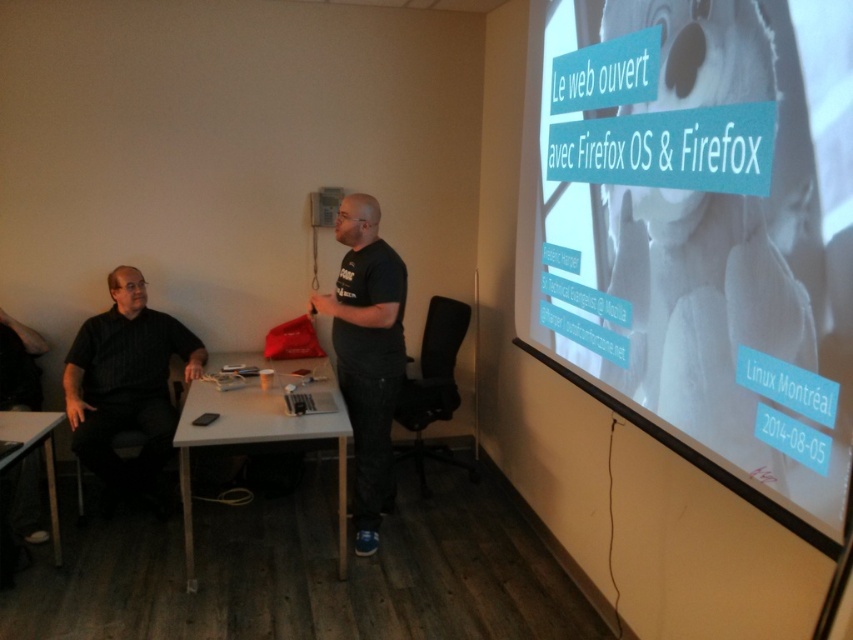
Can you confirm if black matte shirt at left is bigger than matte white table at lower left?

Indeed, black matte shirt at left has a larger size compared to matte white table at lower left.

Between point (143, 340) and point (3, 417), which one is positioned behind?

Point (143, 340)

Is point (194, 340) positioned before point (3, 426)?

That is False.

Identify the location of black matte shirt at left. (126, 387).

Is point (138, 340) more distant than point (387, 481)?

Yes, point (138, 340) is behind point (387, 481).

Is point (144, 496) closer to viewer compared to point (355, 244)?

No, it is not.

Between point (109, 483) and point (376, 225), which one is positioned in front?

Point (376, 225)

Locate an element on the screen. The width and height of the screenshot is (853, 640). black matte shirt at left is located at coordinates (126, 387).

From the picture: Does black matte shirt at center appear over matte white table at lower left?

Yes, black matte shirt at center is above matte white table at lower left.

Is point (346, 282) positioned behind point (55, 500)?

That is True.

The image size is (853, 640). Describe the element at coordinates (367, 353) in the screenshot. I see `black matte shirt at center` at that location.

Locate an element on the screen. The image size is (853, 640). black matte shirt at center is located at coordinates (367, 353).